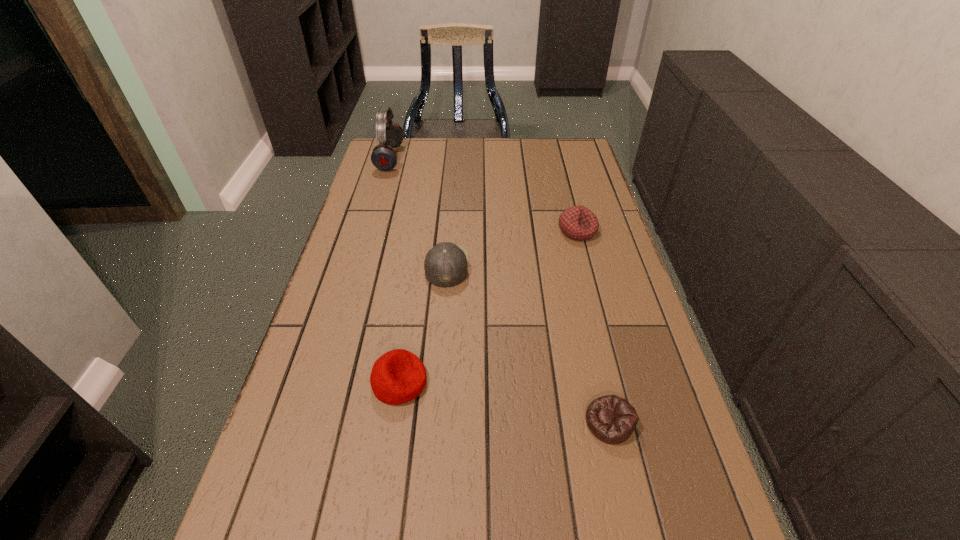
At what (x,y) coordinates should I click in order to perform the action: click on the third closest beanbag to the cap. Please return your answer as a coordinate pair (x, y). This screenshot has height=540, width=960. Looking at the image, I should click on (612, 419).

Point out which beanbag is positioned as the second nearest to the farthest beanbag. Please provide its 2D coordinates. Your answer should be formatted as a tuple, i.e. [(x, y)], where the tuple contains the x and y coordinates of a point satisfying the conditions above.

[(398, 376)]

Locate an element on the screen. The width and height of the screenshot is (960, 540). vacant point that satisfies the following two spatial constraints: 1. on the ear cups of the earphone; 2. on the right side of the second farthest object is located at coordinates (369, 231).

Identify the location of free location that satisfies the following two spatial constraints: 1. on the back side of the shortest beanbag; 2. on the brim of the third nearest object. (574, 266).

This screenshot has width=960, height=540. Find the location of `vacant area in the image that satisfies the following two spatial constraints: 1. on the seat area of the leftmost beanbag; 2. on the back side of the shortest beanbag`. vacant area in the image that satisfies the following two spatial constraints: 1. on the seat area of the leftmost beanbag; 2. on the back side of the shortest beanbag is located at coordinates (394, 422).

This screenshot has width=960, height=540. Find the location of `free space that satisfies the following two spatial constraints: 1. on the ear cups of the shortest object; 2. on the right side of the earphone`. free space that satisfies the following two spatial constraints: 1. on the ear cups of the shortest object; 2. on the right side of the earphone is located at coordinates (313, 422).

Find the location of a particular element. free location that satisfies the following two spatial constraints: 1. on the front side of the farthest beanbag; 2. on the brim of the cap is located at coordinates (587, 266).

This screenshot has height=540, width=960. Identify the location of free space that satisfies the following two spatial constraints: 1. on the brim of the shortest beanbag; 2. on the right side of the third farthest object. pos(435,422).